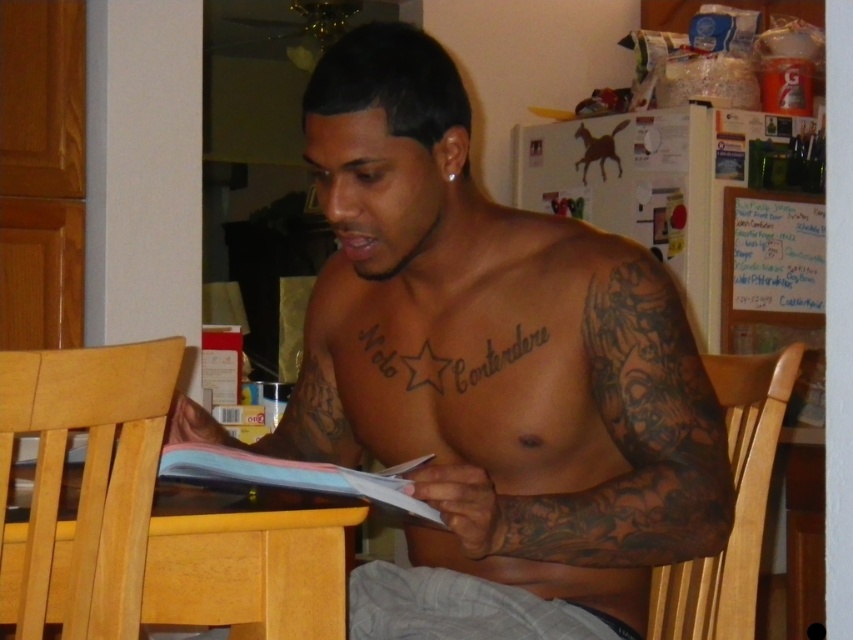
Who is more forward, (556, 516) or (258, 554)?

Positioned in front is point (556, 516).

This screenshot has width=853, height=640. What do you see at coordinates (614, 445) in the screenshot? I see `black tattooed arm at center` at bounding box center [614, 445].

Who is more distant from viewer, (x=643, y=378) or (x=212, y=598)?

Positioned behind is point (x=643, y=378).

Image resolution: width=853 pixels, height=640 pixels. Identify the location of black tattooed arm at center. (614, 445).

Is dark skin tattooed torso at center bigger than light brown wood dining table at lower center?

Indeed, dark skin tattooed torso at center has a larger size compared to light brown wood dining table at lower center.

This screenshot has width=853, height=640. What do you see at coordinates (490, 376) in the screenshot?
I see `dark skin tattooed torso at center` at bounding box center [490, 376].

Who is more forward, (722, 486) or (273, 493)?

Point (722, 486)

Identify the location of dark skin tattooed torso at center. (490, 376).

Is black tattooed arm at center shorter than light brown wooden chair at lower left?

Incorrect, black tattooed arm at center's height does not fall short of light brown wooden chair at lower left's.

What do you see at coordinates (614, 445) in the screenshot? I see `black tattooed arm at center` at bounding box center [614, 445].

The height and width of the screenshot is (640, 853). What do you see at coordinates (614, 445) in the screenshot?
I see `black tattooed arm at center` at bounding box center [614, 445].

The width and height of the screenshot is (853, 640). In order to click on black tattooed arm at center in this screenshot , I will do `click(614, 445)`.